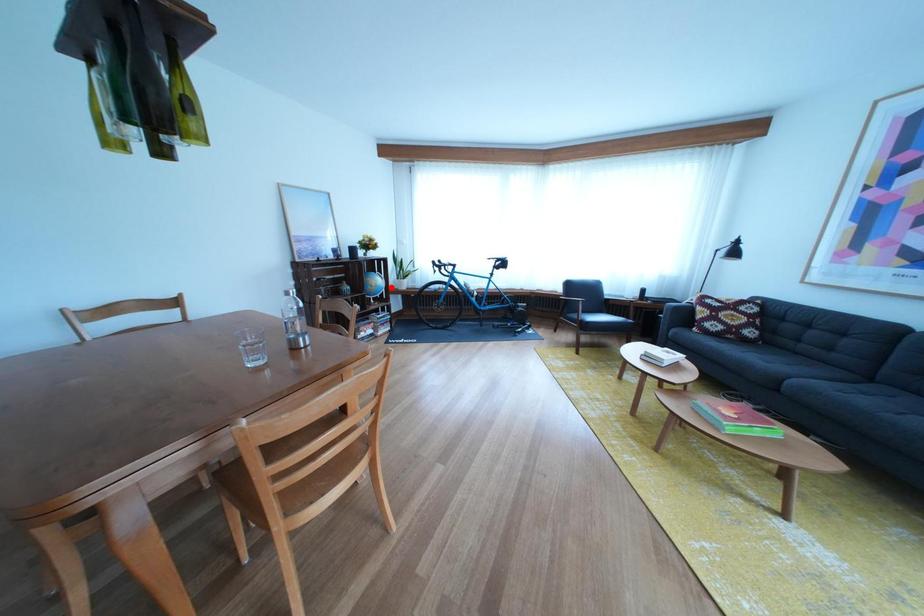
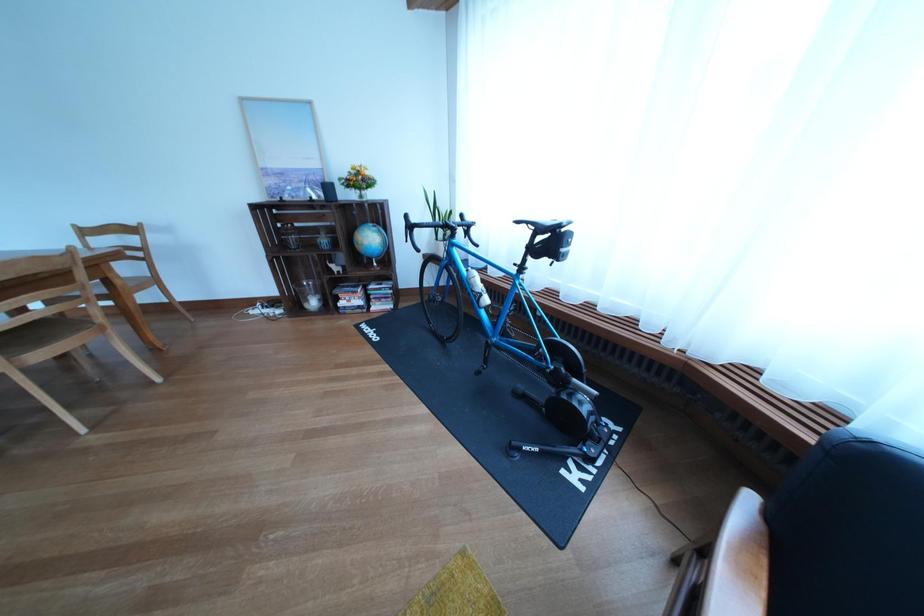
Where in the second image is the point corresponding to the highlighted location from the first image?

(383, 244)